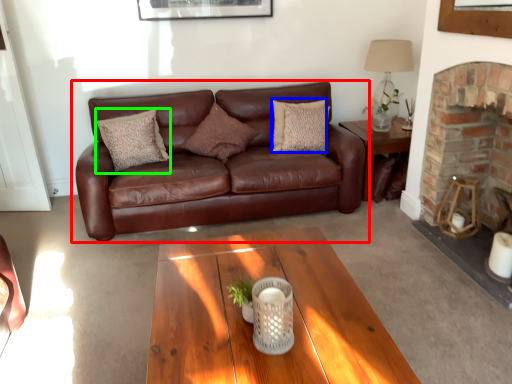
Question: Based on their relative distances, which object is farther from studio couch (highlighted by a red box)? Choose from pillow (highlighted by a blue box) and pillow (highlighted by a green box).

Choices:
 (A) pillow
 (B) pillow

Answer: (A)